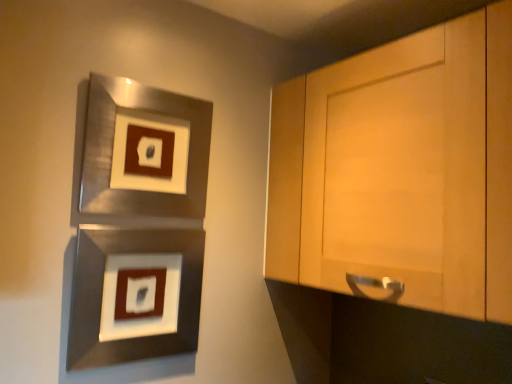
Question: Considering the positions of point (89, 243) and point (202, 130), is point (89, 243) closer or farther from the camera than point (202, 130)?

Choices:
 (A) farther
 (B) closer

Answer: (B)

Question: Looking at their shapes, would you say metallic silver picture frame at lower left, arranged as the 1th picture frame when ordered from the bottom, is wider or thinner than metallic silver picture frame at upper left, acting as the second picture frame starting from the bottom?

Choices:
 (A) thin
 (B) wide

Answer: (B)

Question: From a real-world perspective, is metallic silver picture frame at lower left, arranged as the 1th picture frame when ordered from the bottom, positioned above or below metallic silver picture frame at upper left, positioned as the first picture frame in top-to-bottom order?

Choices:
 (A) below
 (B) above

Answer: (A)

Question: Considering their positions, is metallic silver picture frame at upper left, positioned as the first picture frame in top-to-bottom order, located in front of or behind metallic silver picture frame at lower left, arranged as the 1th picture frame when ordered from the bottom?

Choices:
 (A) front
 (B) behind

Answer: (B)

Question: Is metallic silver picture frame at upper left, positioned as the first picture frame in top-to-bottom order, inside or outside of metallic silver picture frame at lower left, arranged as the 1th picture frame when ordered from the bottom?

Choices:
 (A) inside
 (B) outside

Answer: (B)

Question: From a real-world perspective, relative to metallic silver picture frame at lower left, arranged as the second picture frame when viewed from the top, is metallic silver picture frame at upper left, positioned as the first picture frame in top-to-bottom order, vertically above or below?

Choices:
 (A) below
 (B) above

Answer: (B)

Question: From the image's perspective, is metallic silver picture frame at upper left, acting as the second picture frame starting from the bottom, above or below metallic silver picture frame at lower left, arranged as the second picture frame when viewed from the top?

Choices:
 (A) above
 (B) below

Answer: (A)